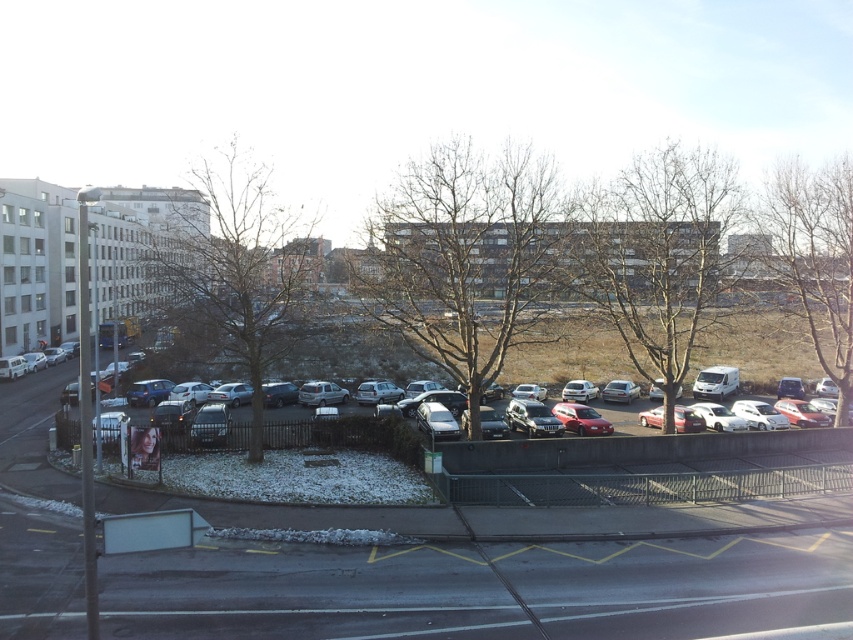
You are standing at the edge of the parking lot near the metal fence and want to take a photo of both point (540, 406) and point (592, 428) in the parking lot. Which point should you focus on first to ensure both are in the frame?

You should focus on point (540, 406) first because it is closer to you than point (592, 428), ensuring both points are within the camera frame.

You are a delivery driver who needs to park your truck in this parking lot. You see two satin silver vehicles at the center of the scene. Which one is taller between the satin silver suv at center and the satin silver sedan at center?

The satin silver suv at center is taller than the satin silver sedan at center.

You are a delivery driver who needs to park your truck in the parking lot. You see a satin silver suv at center and a satin silver sedan at center. Which vehicle should you avoid parking behind to ensure your truck can exit easily?

You should avoid parking behind the satin silver suv at center because it is positioned over the satin silver sedan at center, meaning the sedan is parked behind the SUV. Parking behind the SUV might block the sedan, making it harder for both vehicles to exit.